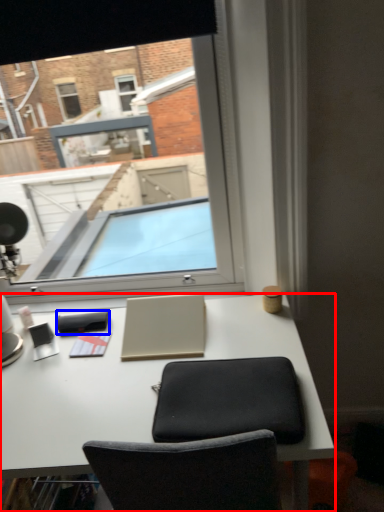
Question: Which object is closer to the camera taking this photo, desk (highlighted by a red box) or notepad (highlighted by a blue box)?

Choices:
 (A) desk
 (B) notepad

Answer: (A)